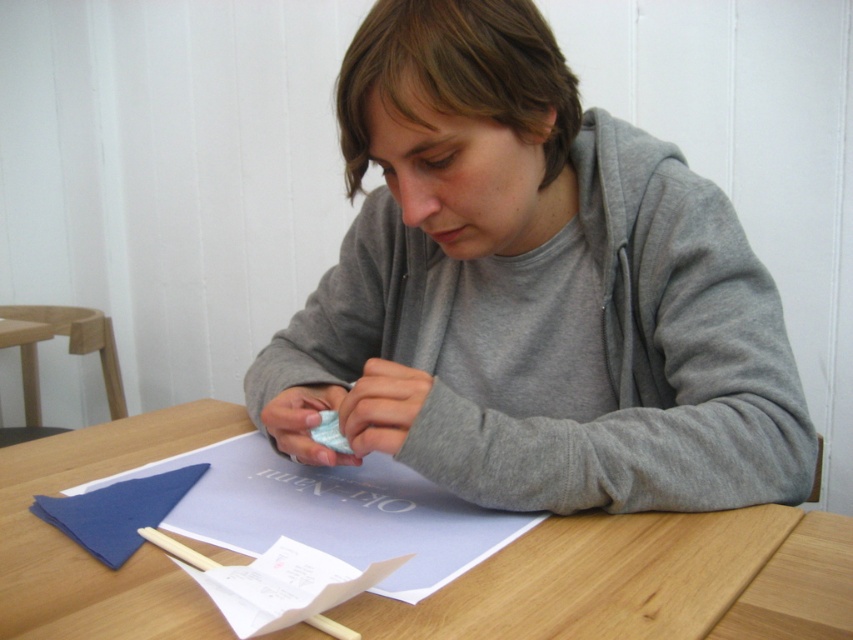
Question: Among these points, which one is farthest from the camera?

Choices:
 (A) (740, 326)
 (B) (686, 605)

Answer: (A)

Question: Is gray cotton hoodie at center positioned in front of wooden table at center?

Choices:
 (A) no
 (B) yes

Answer: (A)

Question: Does gray cotton hoodie at center appear on the right side of wooden table at center?

Choices:
 (A) no
 (B) yes

Answer: (B)

Question: Does gray cotton hoodie at center appear under wooden table at center?

Choices:
 (A) no
 (B) yes

Answer: (A)